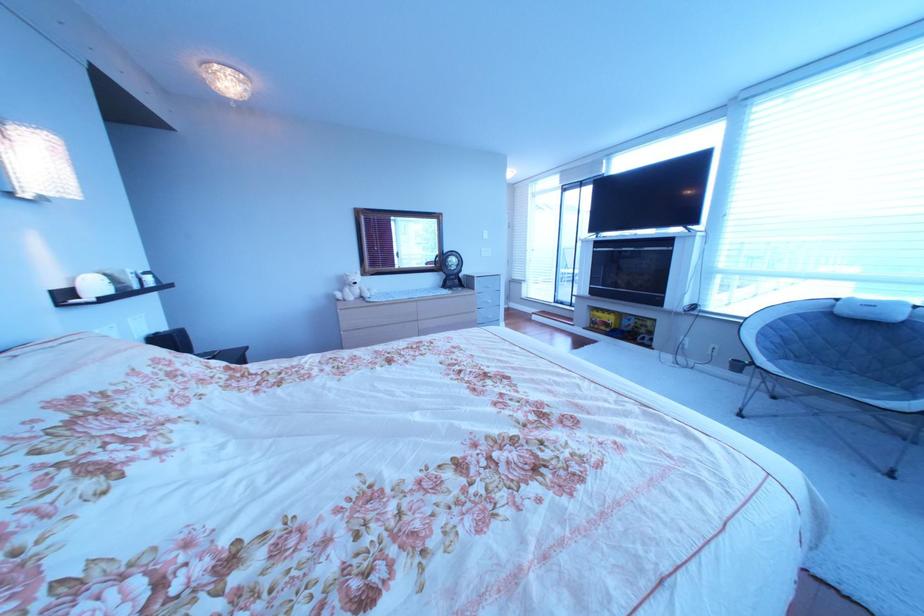
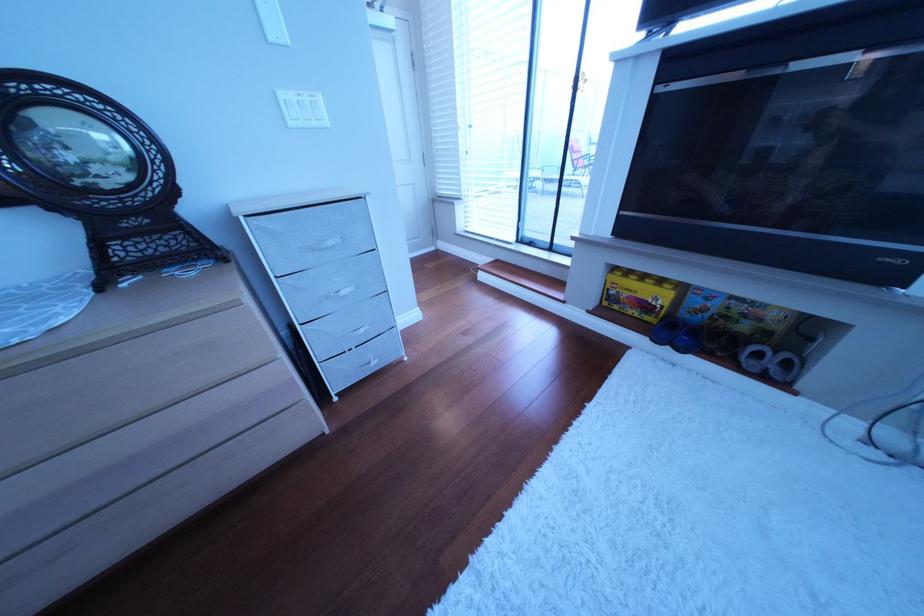
Where in the second image is the point corresponding to (614,322) from the first image?

(640, 296)